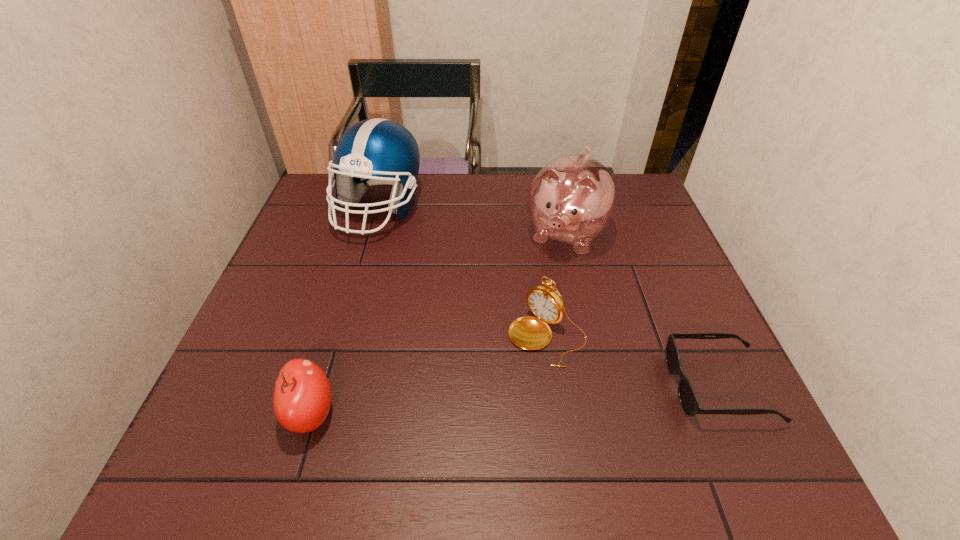
This screenshot has height=540, width=960. In order to click on vacant space that satisfies the following two spatial constraints: 1. on the front side of the football helmet; 2. on the right side of the pocket watch in this screenshot , I will do `click(343, 337)`.

Locate an element on the screen. The image size is (960, 540). vacant area in the image that satisfies the following two spatial constraints: 1. on the back side of the pocket watch; 2. on the right side of the piggy bank is located at coordinates (533, 234).

What are the coordinates of `vacant position in the image that satisfies the following two spatial constraints: 1. on the front side of the piggy bank; 2. on the left side of the football helmet` in the screenshot? It's located at (372, 234).

I want to click on free region that satisfies the following two spatial constraints: 1. on the front side of the piggy bank; 2. at the front lenses of the rightmost object, so click(600, 386).

I want to click on vacant position in the image that satisfies the following two spatial constraints: 1. on the front side of the piggy bank; 2. at the front lenses of the rightmost object, so click(x=600, y=386).